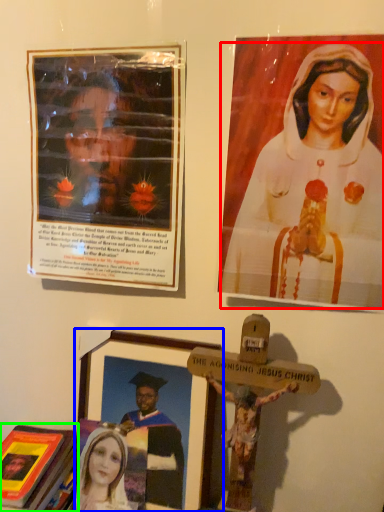
Question: Which is farther away from woman (highlighted by a red box)? picture frame (highlighted by a blue box) or book (highlighted by a green box)?

Choices:
 (A) picture frame
 (B) book

Answer: (B)